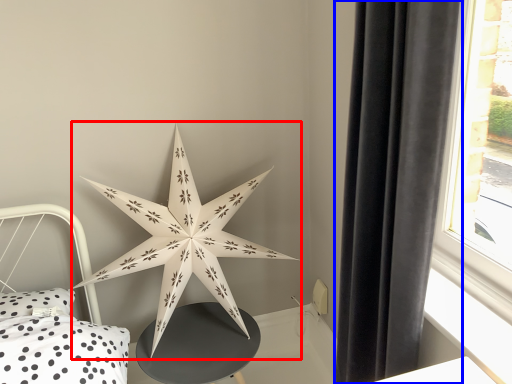
Question: Among these objects, which one is farthest to the camera, star (highlighted by a red box) or curtain (highlighted by a blue box)?

Choices:
 (A) star
 (B) curtain

Answer: (A)